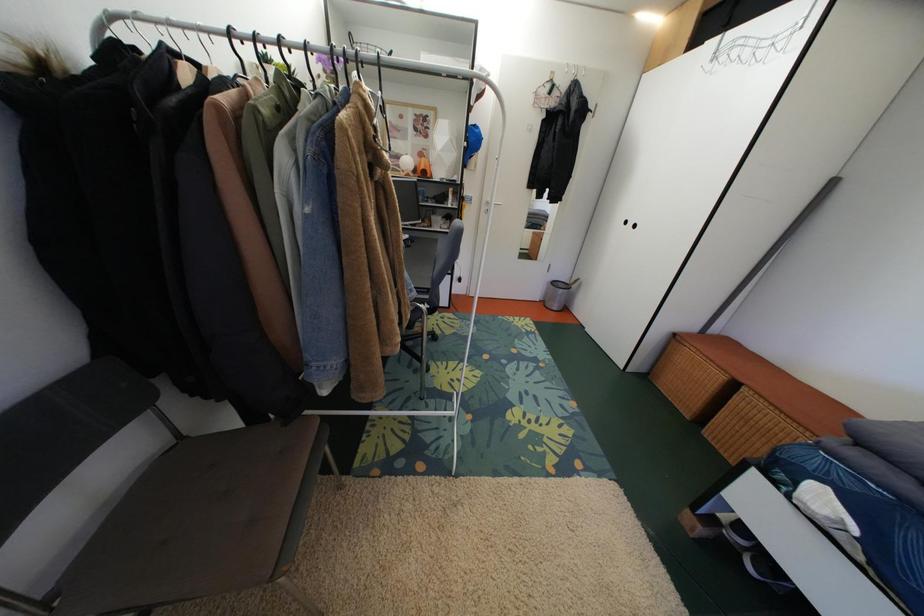
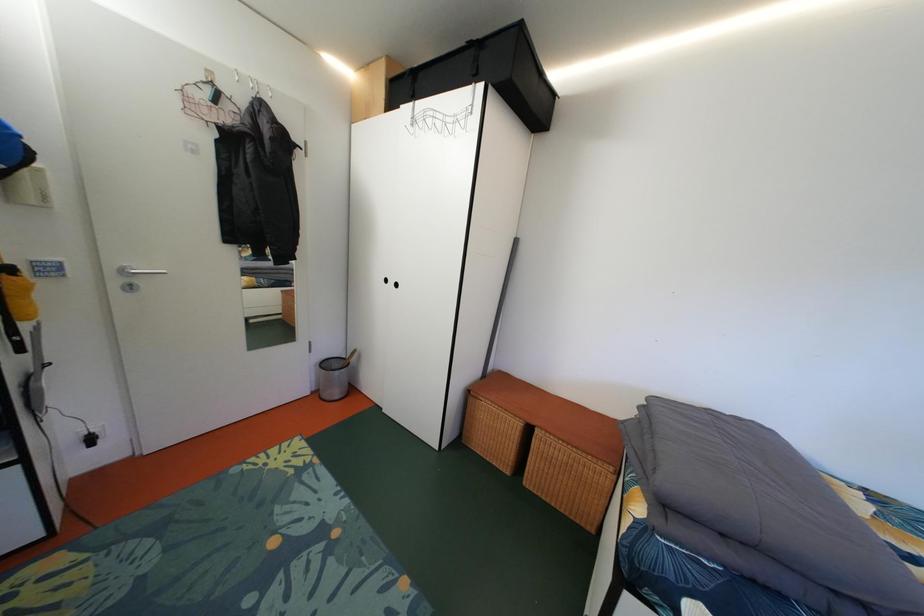
Question: The camera is either moving clockwise (left) or counter-clockwise (right) around the object. The first image is from the beginning of the video and the second image is from the end. Is the camera moving left or right when shooting the video?

Choices:
 (A) Left
 (B) Right

Answer: (A)